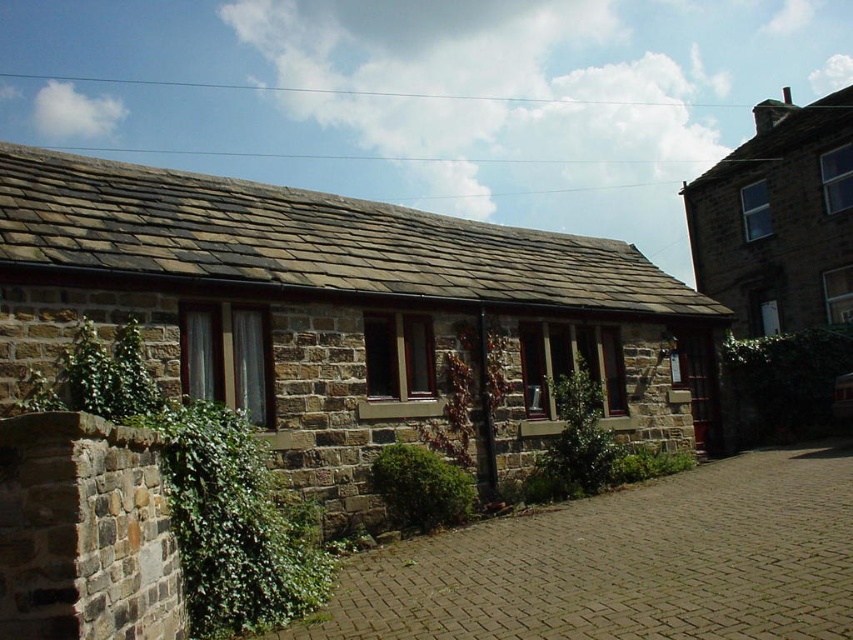
Question: Is brown stone cottage at center to the left of brown stone cottage at upper right from the viewer's perspective?

Choices:
 (A) yes
 (B) no

Answer: (A)

Question: Is green leafy ivy at left wider than brown stone cottage at upper right?

Choices:
 (A) yes
 (B) no

Answer: (B)

Question: Considering the real-world distances, which object is farthest from the green leafy ivy at center?

Choices:
 (A) brown stone cottage at center
 (B) brown stone cottage at upper right
 (C) green leafy ivy at left

Answer: (B)

Question: Which of these objects is positioned closest to the green leafy ivy at center?

Choices:
 (A) brown stone cottage at upper right
 (B) brown stone cottage at center

Answer: (B)

Question: Which point is closer to the camera?

Choices:
 (A) brown stone cottage at center
 (B) green leafy ivy at left

Answer: (B)

Question: Is the position of green leafy ivy at left less distant than that of brown stone cottage at upper right?

Choices:
 (A) yes
 (B) no

Answer: (A)